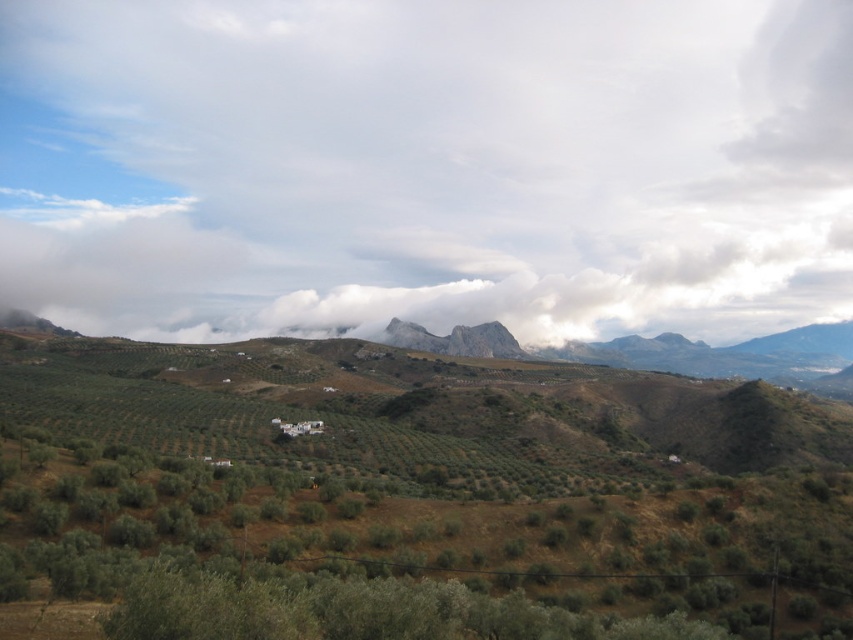
Describe the element at coordinates (427, 164) in the screenshot. I see `white fluffy cloud at upper center` at that location.

Identify the location of white fluffy cloud at upper center. (427, 164).